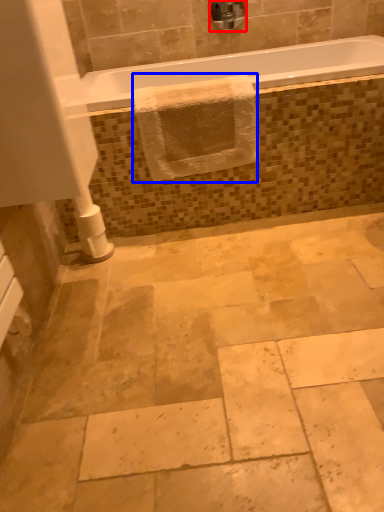
Question: Which object appears farthest to the camera in this image, faucet (highlighted by a red box) or bath towel (highlighted by a blue box)?

Choices:
 (A) faucet
 (B) bath towel

Answer: (A)